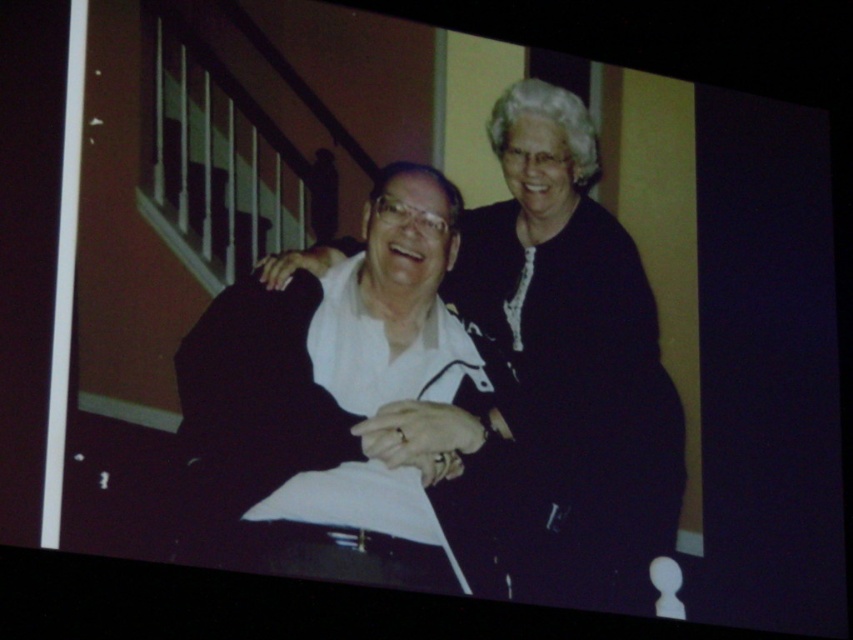
Question: Which point appears farthest from the camera in this image?

Choices:
 (A) (476, 291)
 (B) (357, 342)

Answer: (A)

Question: Does black satin dress at center appear under white matte shirt at center?

Choices:
 (A) no
 (B) yes

Answer: (A)

Question: Is black satin dress at center positioned before white matte shirt at center?

Choices:
 (A) no
 (B) yes

Answer: (A)

Question: In this image, where is black satin dress at center located relative to white matte shirt at center?

Choices:
 (A) above
 (B) below

Answer: (A)

Question: Which point is closer to the camera?

Choices:
 (A) black satin dress at center
 (B) white matte shirt at center

Answer: (B)

Question: Which point is closer to the camera?

Choices:
 (A) white matte shirt at center
 (B) black satin dress at center

Answer: (A)